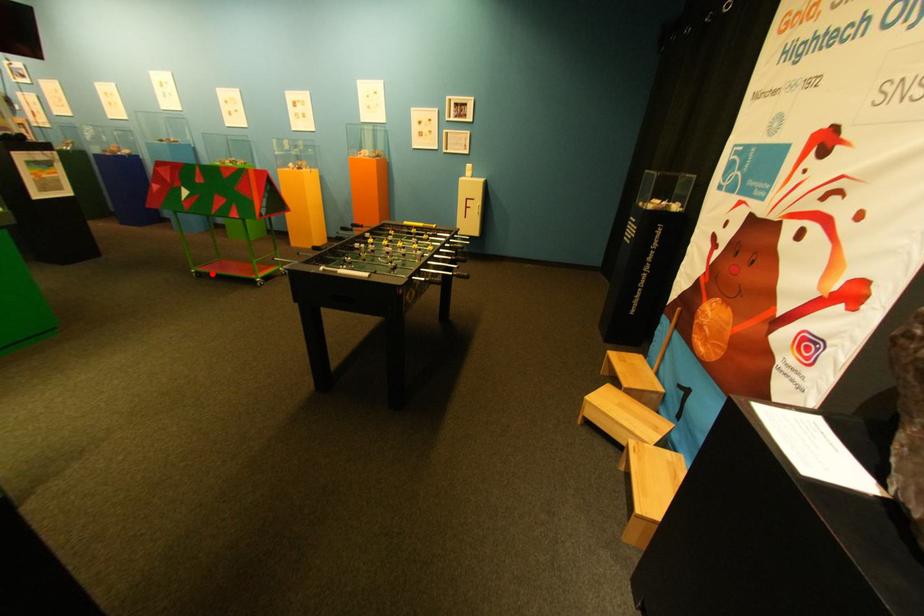
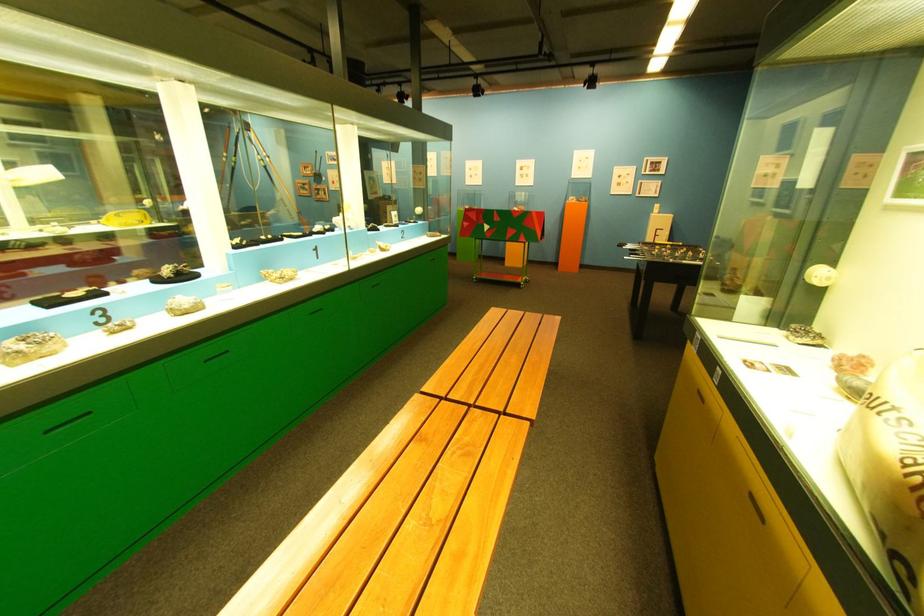
Question: I am providing you with two images of the same scene from different viewpoints. A red point is shown in image1. For the corresponding object point in image2, is it positioned nearer or farther from the camera?

Choices:
 (A) Nearer
 (B) Farther

Answer: (B)